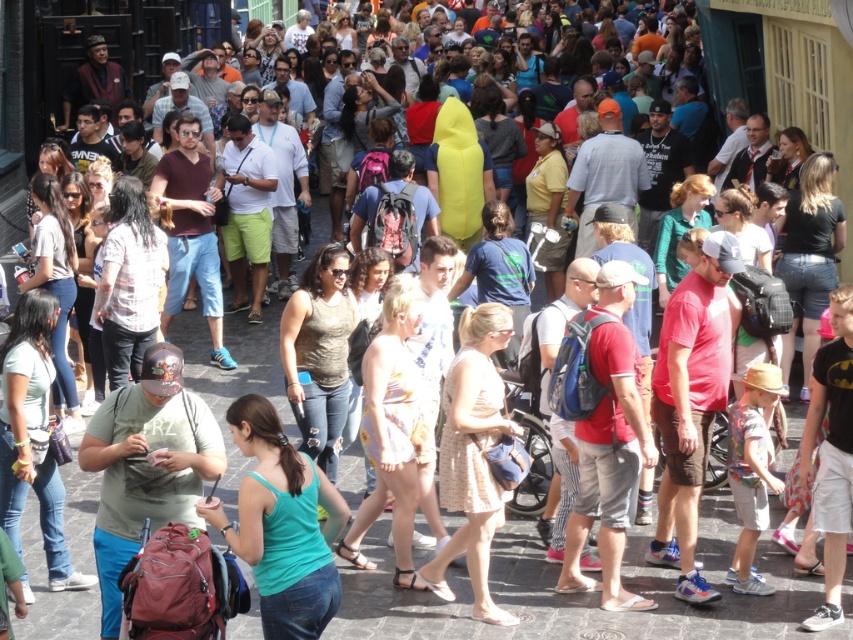
Which of these two, printed cotton dress at center or floral print dress at center, stands shorter?

printed cotton dress at center

Can you confirm if printed cotton dress at center is smaller than floral print dress at center?

Incorrect, printed cotton dress at center is not smaller in size than floral print dress at center.

Does point (500, 310) come farther from viewer compared to point (393, 404)?

No, it is not.

Identify the location of printed cotton dress at center. (473, 454).

In the scene shown: Does floral print dress at center appear on the right side of denim jeans at left?

Indeed, floral print dress at center is positioned on the right side of denim jeans at left.

This screenshot has height=640, width=853. Describe the element at coordinates (393, 429) in the screenshot. I see `floral print dress at center` at that location.

Is point (399, 477) positioned after point (44, 259)?

No, it is in front of (44, 259).

Locate an element on the screen. The image size is (853, 640). floral print dress at center is located at coordinates (393, 429).

Is light blue denim jeans at lower left to the left of black denim shorts at right from the viewer's perspective?

Yes, light blue denim jeans at lower left is to the left of black denim shorts at right.

Does light blue denim jeans at lower left lie behind black denim shorts at right?

No, it is not.

Identify the location of light blue denim jeans at lower left. (32, 435).